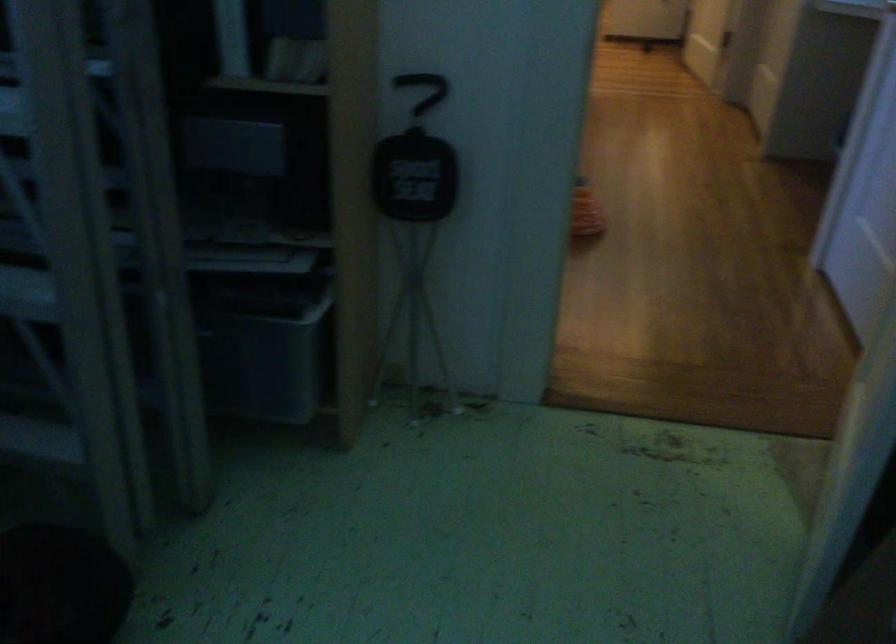
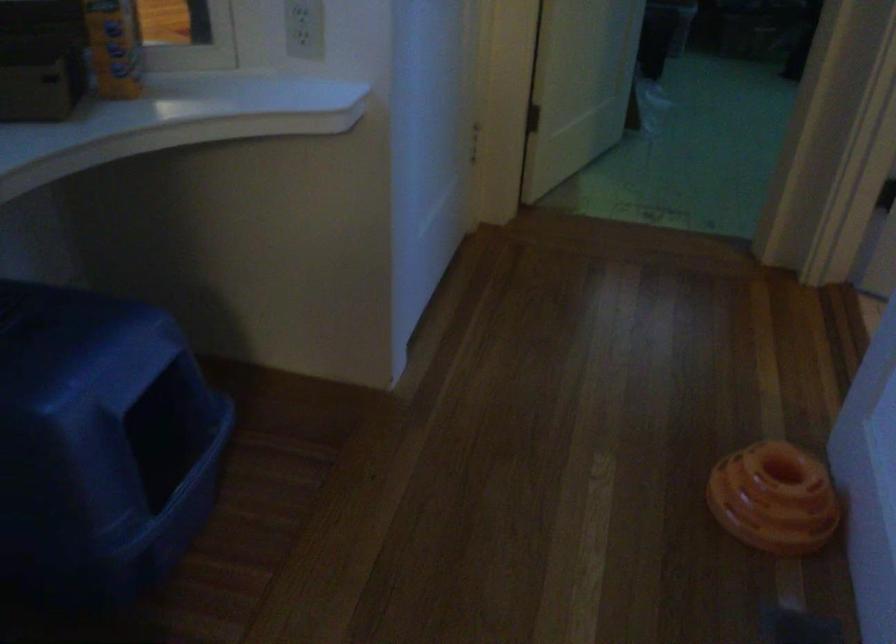
Find the pixel in the second image that matches the point at 591,201 in the first image.

(773, 498)